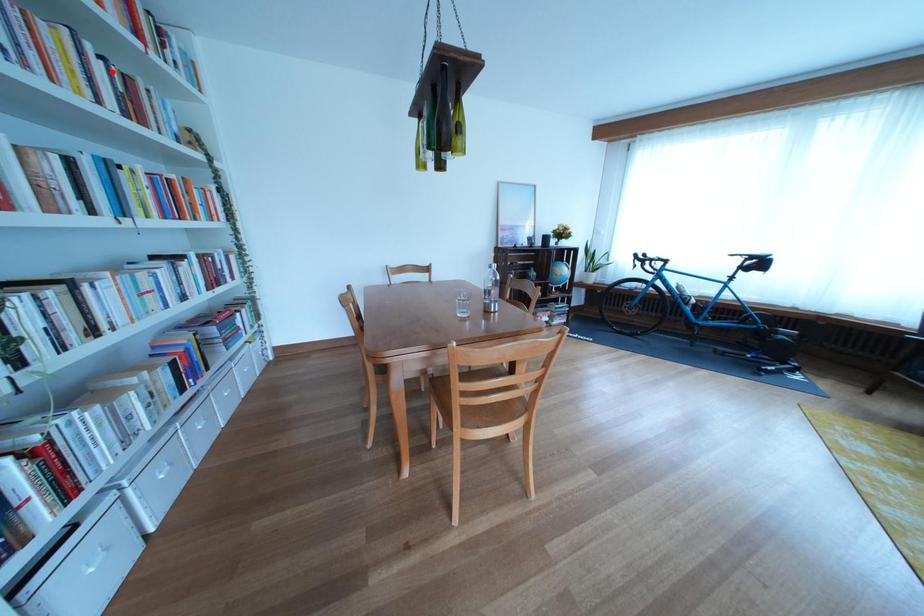
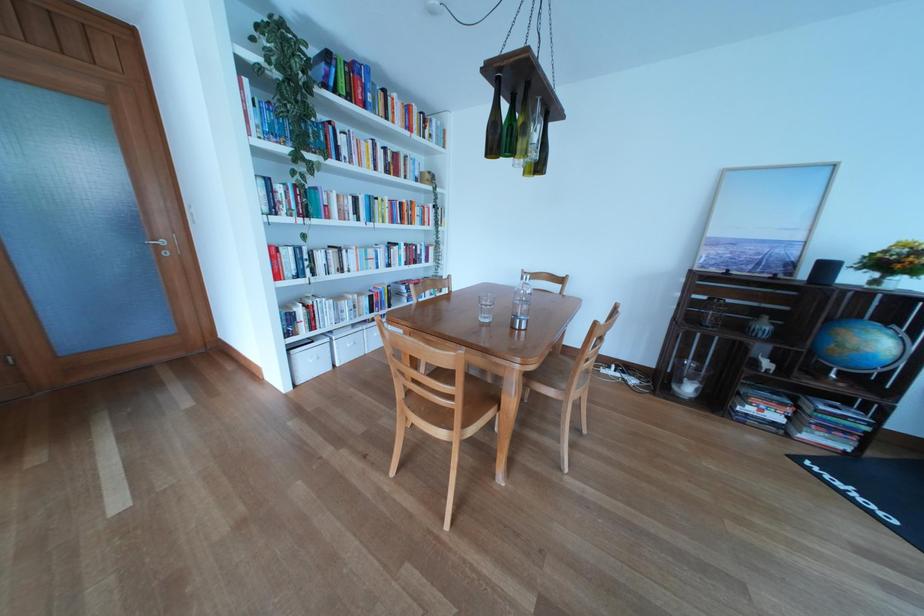
Question: I am providing you with two images of the same scene from different viewpoints. A red point is shown in image1. For the corresponding object point in image2, is it positioned nearer or farther from the camera?

Choices:
 (A) Nearer
 (B) Farther

Answer: (A)